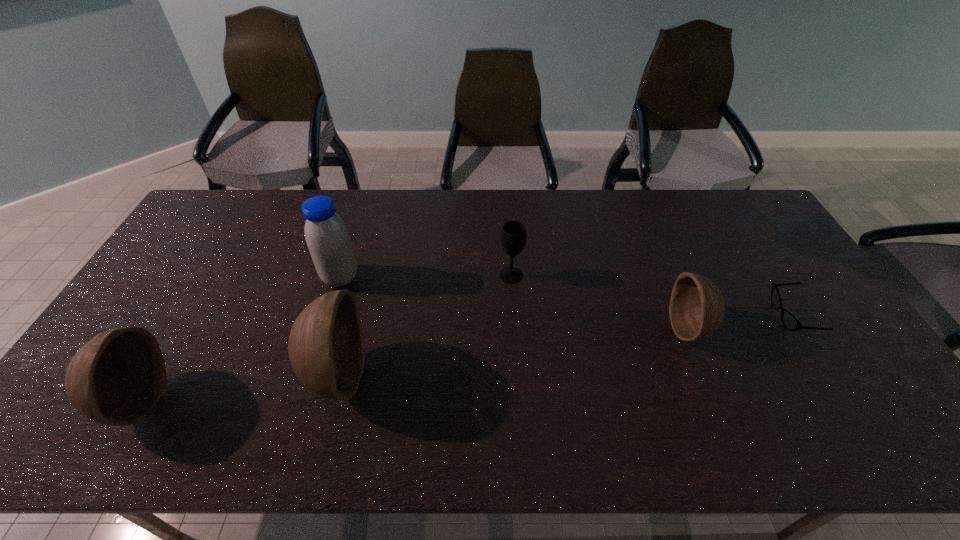
I want to click on the leftmost bowl, so (116, 378).

Locate an element on the screen. Image resolution: width=960 pixels, height=540 pixels. the leftmost object is located at coordinates (116, 378).

Identify the location of the second bowl from left to right. Image resolution: width=960 pixels, height=540 pixels. (326, 347).

What are the coordinates of `the rightmost bowl` in the screenshot? It's located at (697, 308).

Locate an element on the screen. the shortest bowl is located at coordinates (697, 308).

You are a GUI agent. You are given a task and a screenshot of the screen. Output one action in this format:
    pyautogui.click(x=<x>, y=<y>)
    Task: Click on the soya milk
    
    Given the screenshot: What is the action you would take?
    pyautogui.click(x=328, y=240)

What are the coordinates of `the third object from right to left` in the screenshot? It's located at (513, 236).

The image size is (960, 540). I want to click on the rightmost object, so click(x=790, y=322).

Where is `the shortest object`? the shortest object is located at coordinates (790, 322).

This screenshot has width=960, height=540. Find the location of `free point located on the right of the leftmost bowl`. free point located on the right of the leftmost bowl is located at coordinates (293, 400).